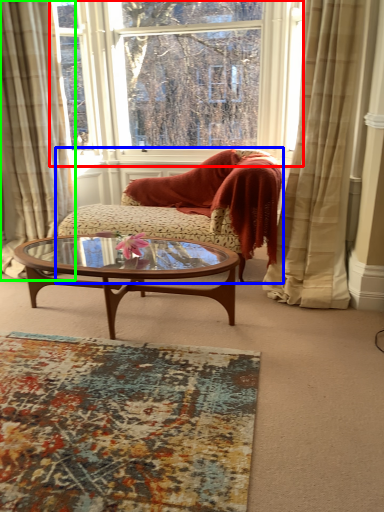
Question: Considering the real-world distances, which object is farthest from window (highlighted by a red box)? studio couch (highlighted by a blue box) or curtain (highlighted by a green box)?

Choices:
 (A) studio couch
 (B) curtain

Answer: (A)